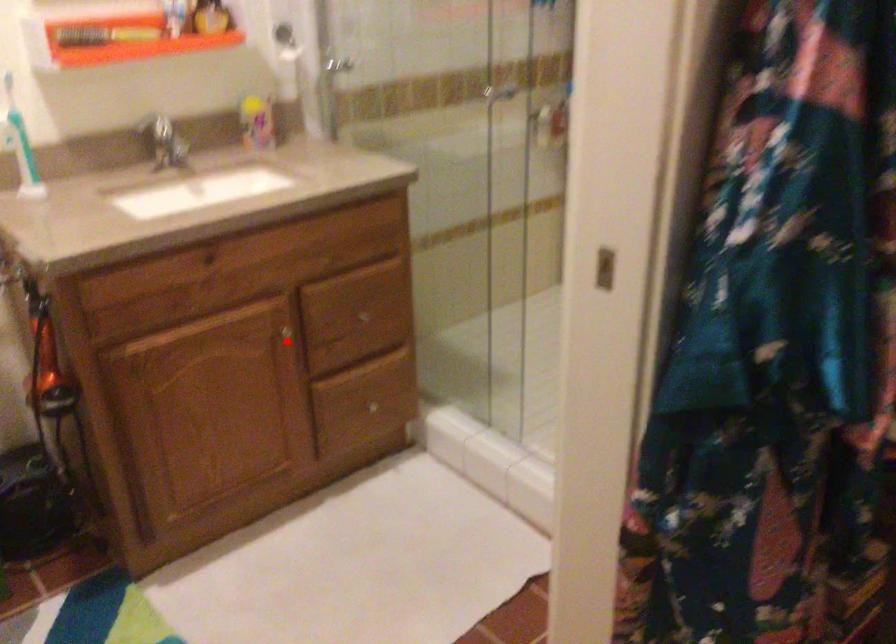
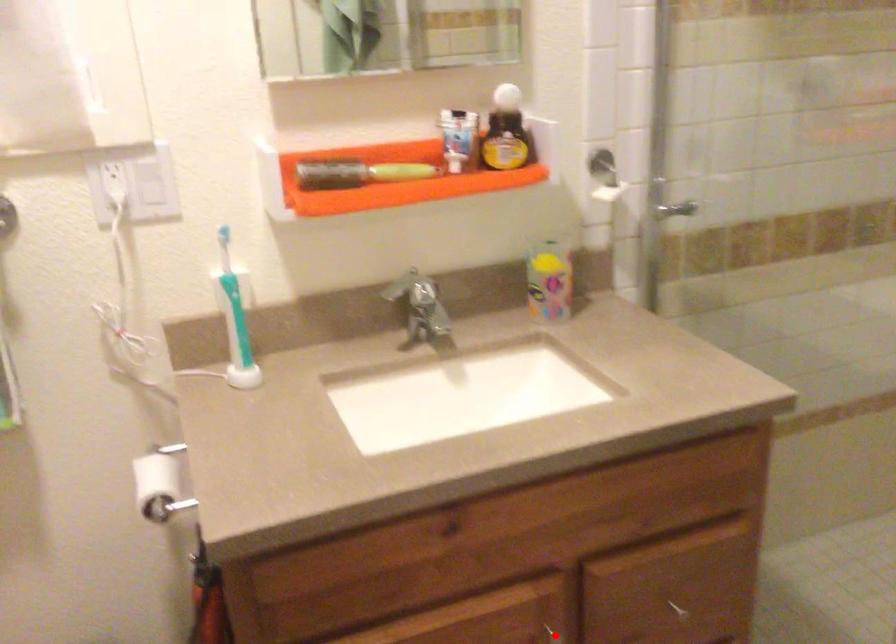
I am providing you with two images of the same scene from different viewpoints. A red point is marked on the first image and another point is marked on the second image. Is the red point in image1 aligned with the point shown in image2?

Yes